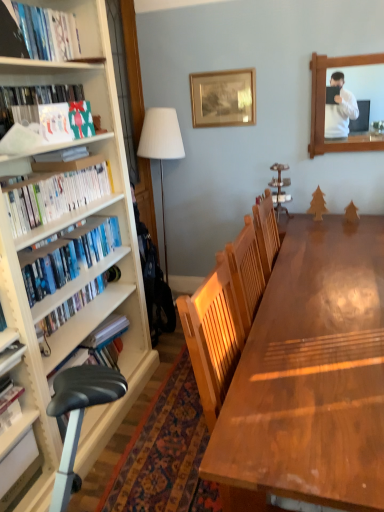
Image resolution: width=384 pixels, height=512 pixels. In order to click on vacant space in hardcover book at left, which is the fifth book from top to bottom (from a real-world perspective) in this screenshot , I will do `click(17, 467)`.